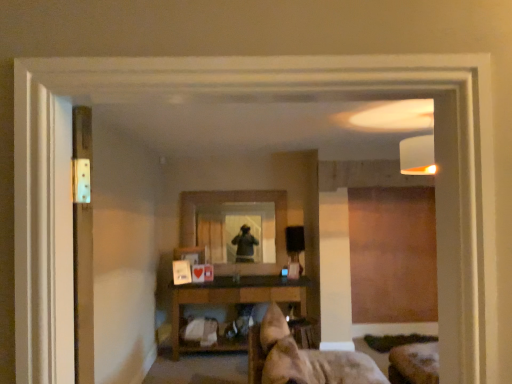
You are a GUI agent. You are given a task and a screenshot of the screen. Output one action in this format:
    pyautogui.click(x=<x>, y=<y>)
    Task: Click on the clear glass mirror at center
    The height and width of the screenshot is (384, 512).
    Given the screenshot: What is the action you would take?
    pyautogui.click(x=231, y=203)

From a real-world perspective, is brown wooden shelf at center positioned above or below clear glass mirror at center?

From a real-world perspective, brown wooden shelf at center is physically below clear glass mirror at center.

Locate an element on the screen. shelf in front of the clear glass mirror at center is located at coordinates (232, 302).

In terms of width, does brown wooden shelf at center look wider or thinner when compared to clear glass mirror at center?

Considering their sizes, brown wooden shelf at center looks broader than clear glass mirror at center.

Is metallic silver screen door at left inside the boundaries of clear glass mirror at center, or outside?

metallic silver screen door at left cannot be found inside clear glass mirror at center.

Which of these two, metallic silver screen door at left or clear glass mirror at center, is wider?

clear glass mirror at center is wider.

Considering the positions of point (56, 178) and point (286, 255), is point (56, 178) closer or farther from the camera than point (286, 255)?

Point (56, 178).

Locate an element on the screen. mirror above the brown wooden shelf at center (from the image's perspective) is located at coordinates (231, 203).

From a real-world perspective, is clear glass mirror at center on top of brown wooden shelf at center?

Correct, in the physical world, clear glass mirror at center is higher than brown wooden shelf at center.

Considering the positions of points (282, 252) and (173, 297), is point (282, 252) farther from camera compared to point (173, 297)?

Yes, point (282, 252) is behind point (173, 297).

Could you tell me if clear glass mirror at center is turned towards brown wooden shelf at center?

No, clear glass mirror at center is not aimed at brown wooden shelf at center.

From the image's perspective, is metallic silver screen door at left located beneath brown wooden shelf at center?

No.

Relative to brown wooden shelf at center, is metallic silver screen door at left in front or behind?

metallic silver screen door at left is positioned closer to the viewer than brown wooden shelf at center.

Between metallic silver screen door at left and brown wooden shelf at center, which one appears on the left side from the viewer's perspective?

Positioned to the left is metallic silver screen door at left.

Would you say metallic silver screen door at left is inside or outside brown wooden shelf at center?

metallic silver screen door at left is outside brown wooden shelf at center.

Who is smaller, brown wooden shelf at center or metallic silver screen door at left?

Smaller between the two is metallic silver screen door at left.

Who is shorter, brown wooden shelf at center or metallic silver screen door at left?

With less height is metallic silver screen door at left.

How distant is brown wooden shelf at center from metallic silver screen door at left?

brown wooden shelf at center and metallic silver screen door at left are 3.89 meters apart from each other.

Is the surface of brown wooden shelf at center in direct contact with metallic silver screen door at left?

No, brown wooden shelf at center is not with metallic silver screen door at left.

Based on the photo, considering the positions of objects clear glass mirror at center and metallic silver screen door at left in the image provided, who is more to the right, clear glass mirror at center or metallic silver screen door at left?

clear glass mirror at center.

From a real-world perspective, is clear glass mirror at center positioned above or below metallic silver screen door at left?

clear glass mirror at center is situated lower than metallic silver screen door at left in the real world.

Is clear glass mirror at center taller or shorter than metallic silver screen door at left?

Considering their sizes, clear glass mirror at center has more height than metallic silver screen door at left.

Which is correct: clear glass mirror at center is inside metallic silver screen door at left, or outside of it?

clear glass mirror at center cannot be found inside metallic silver screen door at left.

In the image, there is a brown wooden shelf at center. At what (x,y) coordinates should I click in order to perform the action: click on mirror above it (from the image's perspective). Please return your answer as a coordinate pair (x, y). Looking at the image, I should click on (231, 203).

Identify the location of mirror below the metallic silver screen door at left (from the image's perspective). The height and width of the screenshot is (384, 512). (231, 203).

When comparing their distances from brown wooden shelf at center, does metallic silver screen door at left or clear glass mirror at center seem closer?

clear glass mirror at center is closer to brown wooden shelf at center.

Which object lies further to the anchor point clear glass mirror at center, brown wooden shelf at center or metallic silver screen door at left?

metallic silver screen door at left.

Based on their spatial positions, is metallic silver screen door at left or brown wooden shelf at center further from clear glass mirror at center?

metallic silver screen door at left is further to clear glass mirror at center.

When comparing their distances from brown wooden shelf at center, does clear glass mirror at center or metallic silver screen door at left seem closer?

The object closer to brown wooden shelf at center is clear glass mirror at center.

From the image, which object appears to be farther from metallic silver screen door at left, clear glass mirror at center or brown wooden shelf at center?

Among the two, clear glass mirror at center is located further to metallic silver screen door at left.

Which object lies nearer to the anchor point metallic silver screen door at left, brown wooden shelf at center or clear glass mirror at center?

Among the two, brown wooden shelf at center is located nearer to metallic silver screen door at left.

This screenshot has width=512, height=384. What are the coordinates of `shelf between metallic silver screen door at left and clear glass mirror at center along the z-axis` in the screenshot? It's located at (232, 302).